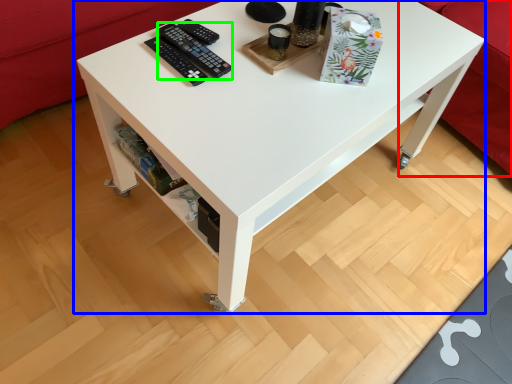
Question: Which is farther away from couch (highlighted by a red box)? table (highlighted by a blue box) or control (highlighted by a green box)?

Choices:
 (A) table
 (B) control

Answer: (B)